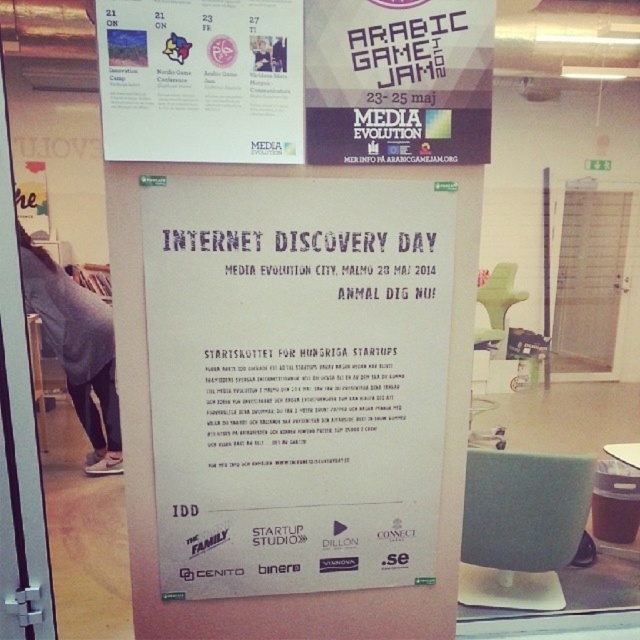
Question: Is white paper poster at center bigger than white paper poster at upper center?

Choices:
 (A) yes
 (B) no

Answer: (A)

Question: Is white paper poster at upper center above matte white sign at upper center?

Choices:
 (A) no
 (B) yes

Answer: (A)

Question: Estimate the real-world distances between objects in this image. Which object is closer to the white paper poster at center?

Choices:
 (A) white paper poster at upper center
 (B) matte white sign at upper center

Answer: (A)

Question: Which of these objects is positioned closest to the matte white sign at upper center?

Choices:
 (A) white paper poster at upper center
 (B) white paper poster at center

Answer: (A)

Question: From the image, what is the correct spatial relationship of white paper poster at center in relation to white paper poster at upper center?

Choices:
 (A) right
 (B) left

Answer: (A)

Question: Which point is farther to the camera?

Choices:
 (A) white paper poster at upper center
 (B) matte white sign at upper center
 (C) white paper poster at center

Answer: (C)